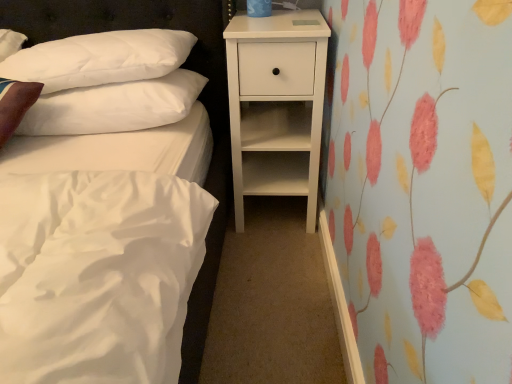
Question: Is white soft pillow at upper left, acting as the 1th pillow starting from the top, touching white soft pillow at upper left, positioned as the first pillow in bottom-to-top order?

Choices:
 (A) yes
 (B) no

Answer: (A)

Question: Is white soft pillow at upper left, acting as the 1th pillow starting from the top, wider than white soft pillow at upper left, positioned as the first pillow in bottom-to-top order?

Choices:
 (A) yes
 (B) no

Answer: (B)

Question: Is white soft pillow at upper left, marked as the second pillow in a bottom-to-top arrangement, outside white soft pillow at upper left, positioned as the first pillow in bottom-to-top order?

Choices:
 (A) no
 (B) yes

Answer: (B)

Question: Considering the relative sizes of white soft pillow at upper left, acting as the 1th pillow starting from the top, and white soft pillow at upper left, positioned as the first pillow in bottom-to-top order, in the image provided, is white soft pillow at upper left, acting as the 1th pillow starting from the top, smaller than white soft pillow at upper left, positioned as the first pillow in bottom-to-top order,?

Choices:
 (A) no
 (B) yes

Answer: (A)

Question: Would you consider white soft pillow at upper left, marked as the second pillow in a bottom-to-top arrangement, to be distant from white soft pillow at upper left, which is the 2th pillow in top-to-bottom order?

Choices:
 (A) yes
 (B) no

Answer: (B)

Question: Is white soft pillow at upper left, marked as the second pillow in a bottom-to-top arrangement, taller than white soft pillow at upper left, positioned as the first pillow in bottom-to-top order?

Choices:
 (A) no
 (B) yes

Answer: (B)

Question: Is white matte nightstand at center facing away from white soft pillow at upper left, positioned as the first pillow in bottom-to-top order?

Choices:
 (A) no
 (B) yes

Answer: (A)

Question: Is white matte nightstand at center bigger than white soft pillow at upper left, positioned as the first pillow in bottom-to-top order?

Choices:
 (A) no
 (B) yes

Answer: (B)

Question: Is the position of white matte nightstand at center more distant than that of white soft pillow at upper left, which is the 2th pillow in top-to-bottom order?

Choices:
 (A) no
 (B) yes

Answer: (B)

Question: Is white matte nightstand at center beside white soft pillow at upper left, which is the 2th pillow in top-to-bottom order?

Choices:
 (A) yes
 (B) no

Answer: (B)

Question: Is white matte nightstand at center positioned beyond the bounds of white soft pillow at upper left, which is the 2th pillow in top-to-bottom order?

Choices:
 (A) yes
 (B) no

Answer: (A)

Question: Considering the relative sizes of white matte nightstand at center and white soft pillow at upper left, positioned as the first pillow in bottom-to-top order, in the image provided, is white matte nightstand at center taller than white soft pillow at upper left, positioned as the first pillow in bottom-to-top order,?

Choices:
 (A) yes
 (B) no

Answer: (A)

Question: Is white soft pillow at upper left, positioned as the first pillow in bottom-to-top order, outside white soft pillow at upper left, marked as the second pillow in a bottom-to-top arrangement?

Choices:
 (A) no
 (B) yes

Answer: (A)